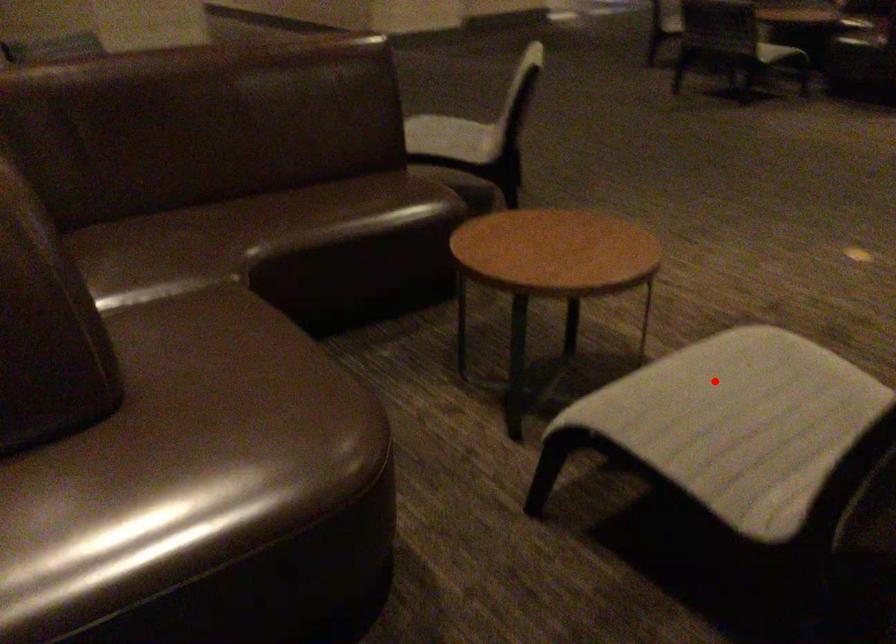
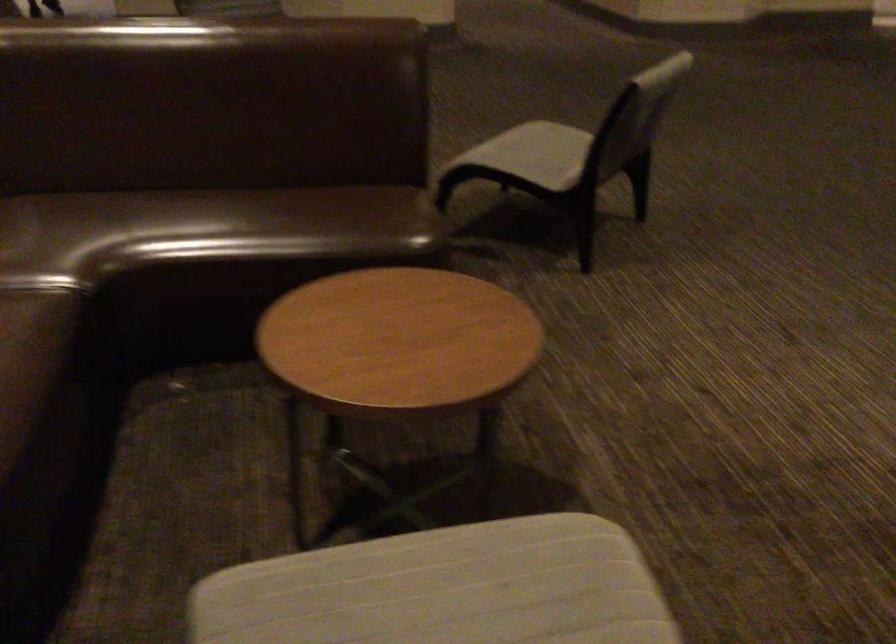
Question: I am providing you with two images of the same scene from different viewpoints. Given a red point in image1, look at the same physical point in image2. Is it:

Choices:
 (A) Closer to the viewpoint
 (B) Farther from the viewpoint

Answer: (A)